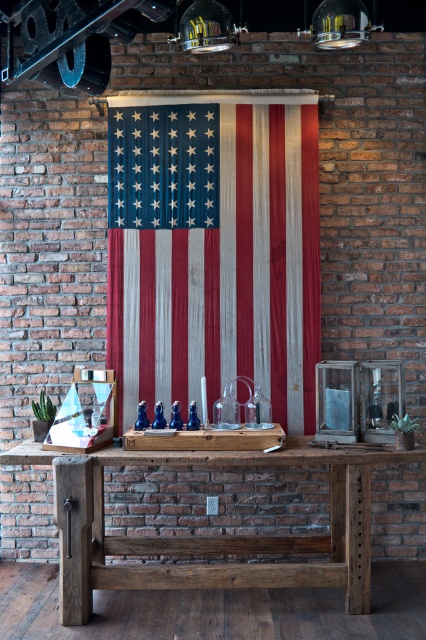
Question: Can you confirm if rustic wood american flag at center is positioned above rustic wood table at center?

Choices:
 (A) no
 (B) yes

Answer: (B)

Question: Is rustic wood american flag at center wider than rustic wood table at center?

Choices:
 (A) yes
 (B) no

Answer: (B)

Question: Which point is closer to the camera?

Choices:
 (A) (262, 208)
 (B) (95, 525)

Answer: (B)

Question: Which point is closer to the camera?

Choices:
 (A) rustic wood american flag at center
 (B) rustic wood table at center

Answer: (B)

Question: Which point is farther to the camera?

Choices:
 (A) (60, 611)
 (B) (236, 320)

Answer: (B)

Question: Can you confirm if rustic wood american flag at center is positioned below rustic wood table at center?

Choices:
 (A) yes
 (B) no

Answer: (B)